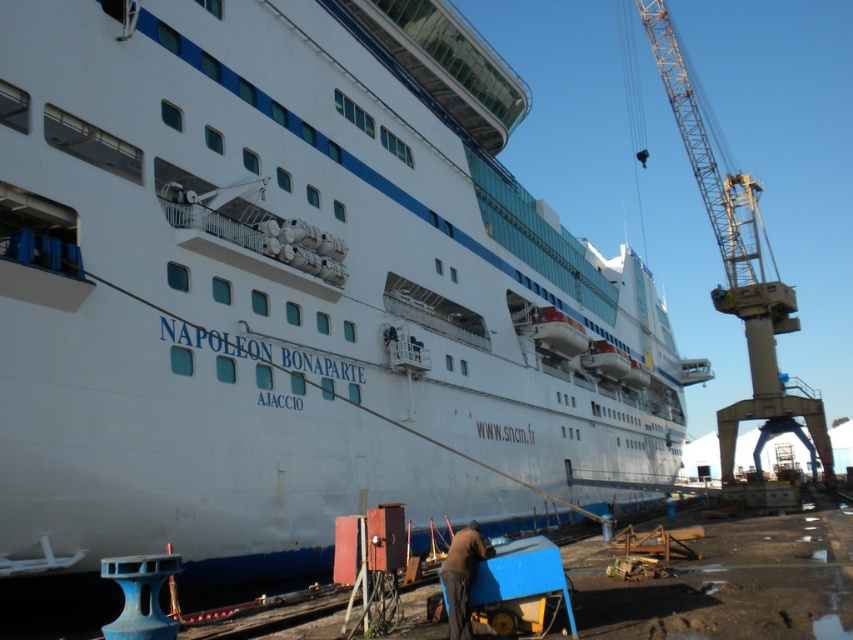
You are a dock worker tasked with securing the Napoleon Bonaparte cruise ship. You need to attach a safety line from the ship to the metallic yellow crane at right. Given the coordinates provided, can you determine the shortest path to connect them without crossing any industrial equipment?

The metallic yellow crane at right is located at point (737,264). The shortest path would involve moving directly from the ship to this coordinate, ensuring no obstructions are in the way. However, since the exact positions of other equipment aren not specified, proceed with caution and check for any potential obstacles along the route.

You are standing next to the metallic yellow crane at right and want to take a photo of the cruise ship Napoleon Bonaparte. The camera you have can only focus on objects within 80 meters. Will the camera be able to capture the cruise ship clearly?

The metallic yellow crane at right and camera are 78.09 meters apart from each other. Since the camera can focus up to 80 meters, the distance of 78.09 meters is within the range. Therefore, the camera can capture the cruise ship clearly.

You are a dock worker who needs to move a large crate. You see the metallic yellow crane at right and the brown leather jacket at lower center. Which object can you use to lift the crate?

The metallic yellow crane at right can be used to lift the crate because it is bigger than the brown leather jacket at lower center.